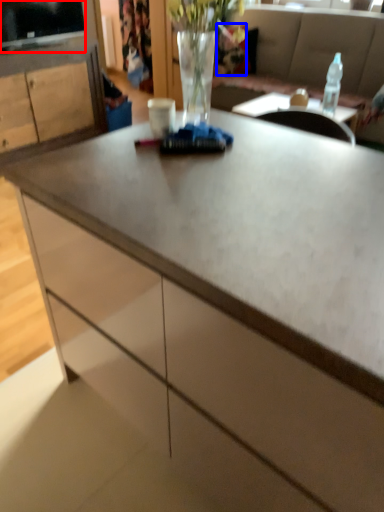
Question: Which of the following is the farthest to the observer, television (highlighted by a red box) or flower (highlighted by a blue box)?

Choices:
 (A) television
 (B) flower

Answer: (B)